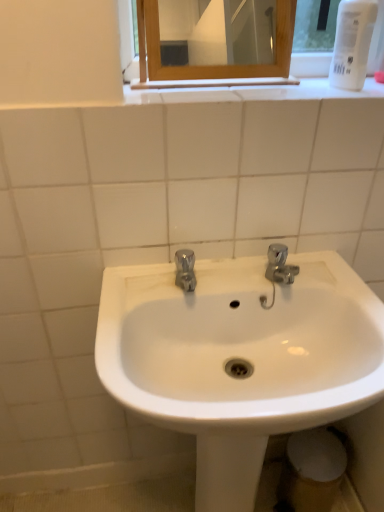
Question: Is wooden-framed mirror at upper center behind white glossy sink at center?

Choices:
 (A) yes
 (B) no

Answer: (A)

Question: Is wooden-framed mirror at upper center located outside white glossy sink at center?

Choices:
 (A) yes
 (B) no

Answer: (A)

Question: From the image's perspective, would you say wooden-framed mirror at upper center is shown under white glossy sink at center?

Choices:
 (A) no
 (B) yes

Answer: (A)

Question: Is wooden-framed mirror at upper center shorter than white glossy sink at center?

Choices:
 (A) yes
 (B) no

Answer: (A)

Question: Considering the relative sizes of wooden-framed mirror at upper center and white glossy sink at center in the image provided, is wooden-framed mirror at upper center thinner than white glossy sink at center?

Choices:
 (A) yes
 (B) no

Answer: (A)

Question: Does wooden-framed mirror at upper center have a smaller size compared to white glossy sink at center?

Choices:
 (A) yes
 (B) no

Answer: (A)

Question: Is polished chrome faucet at center positioned with its back to white plastic bottle at upper right?

Choices:
 (A) yes
 (B) no

Answer: (B)

Question: From a real-world perspective, is polished chrome faucet at center physically below white plastic bottle at upper right?

Choices:
 (A) yes
 (B) no

Answer: (A)

Question: Could you tell me if polished chrome faucet at center is facing white plastic bottle at upper right?

Choices:
 (A) no
 (B) yes

Answer: (A)

Question: Does polished chrome faucet at center contain white plastic bottle at upper right?

Choices:
 (A) no
 (B) yes

Answer: (A)

Question: Can you see polished chrome faucet at center touching white plastic bottle at upper right?

Choices:
 (A) no
 (B) yes

Answer: (A)

Question: Is polished chrome faucet at center taller than white plastic bottle at upper right?

Choices:
 (A) yes
 (B) no

Answer: (B)

Question: Is white plastic bottle at upper right facing towards polished chrome faucet at center?

Choices:
 (A) no
 (B) yes

Answer: (A)